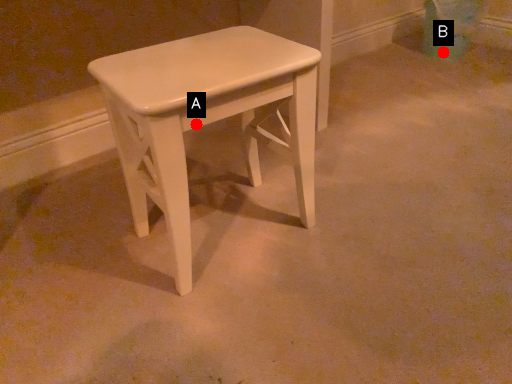
Question: Two points are circled on the image, labeled by A and B beside each circle. Which point is farther to the camera?

Choices:
 (A) A is further
 (B) B is further

Answer: (B)